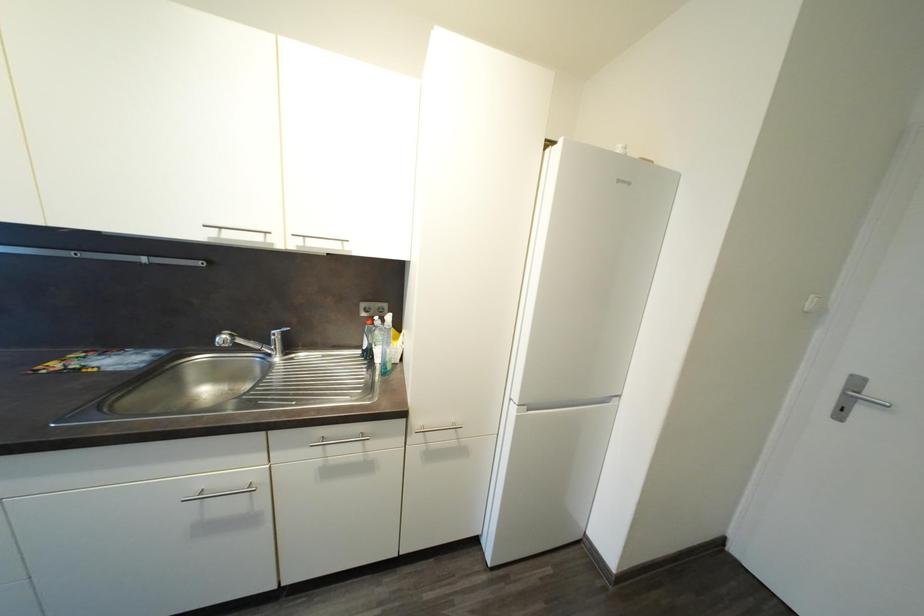
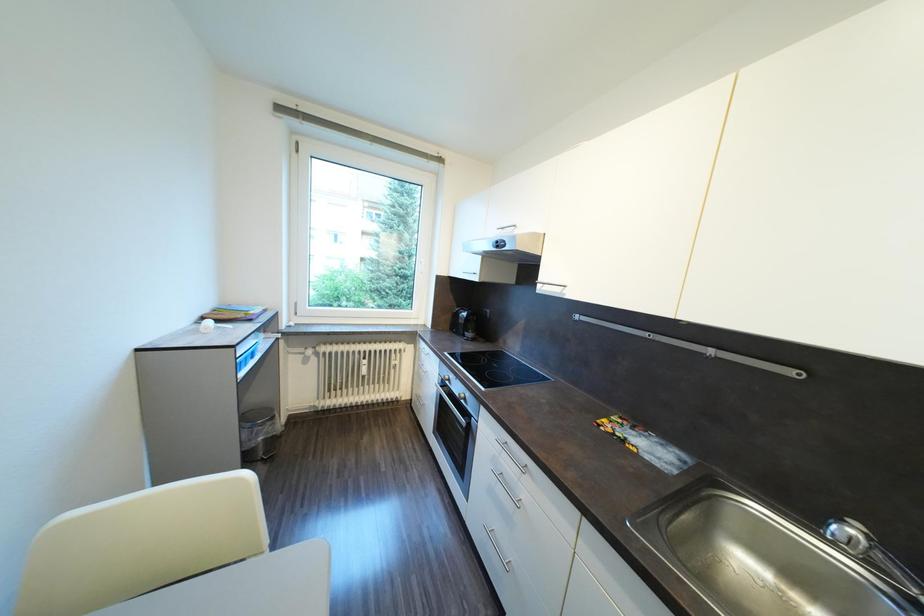
Question: The first image is from the beginning of the video and the second image is from the end. How did the camera likely rotate when shooting the video?

Choices:
 (A) Left
 (B) Right
 (C) Up
 (D) Down

Answer: (A)